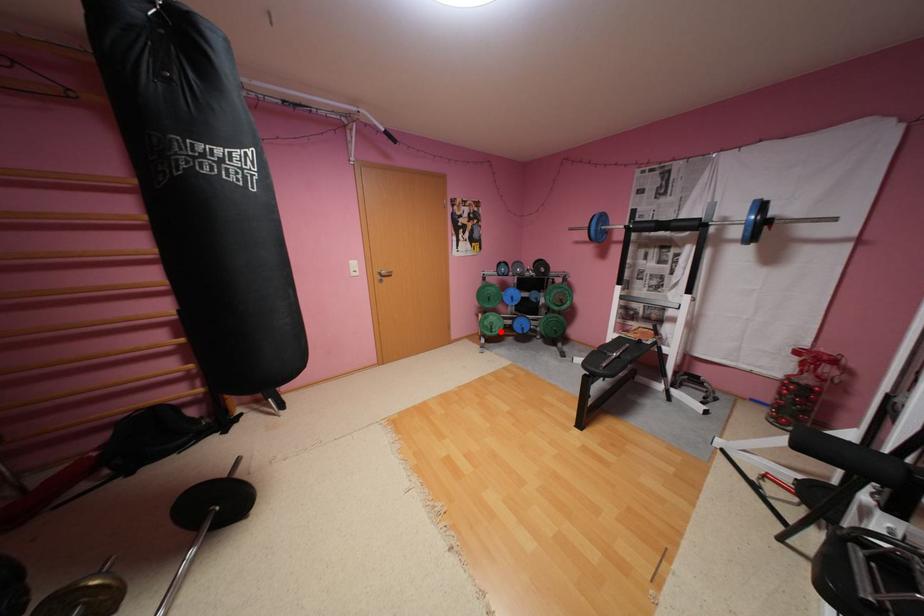
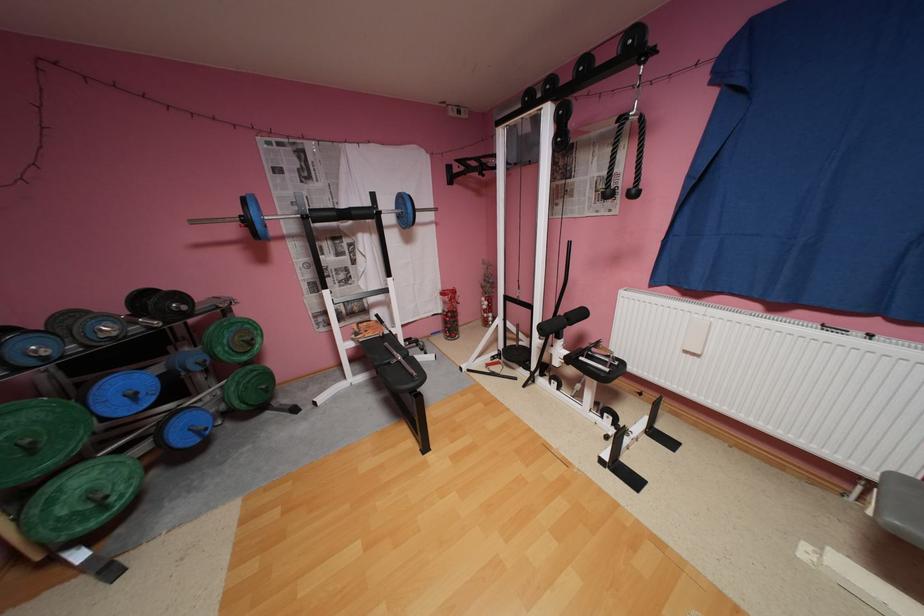
Find the pixel in the second image that matches the highlighted location in the first image.

(116, 508)